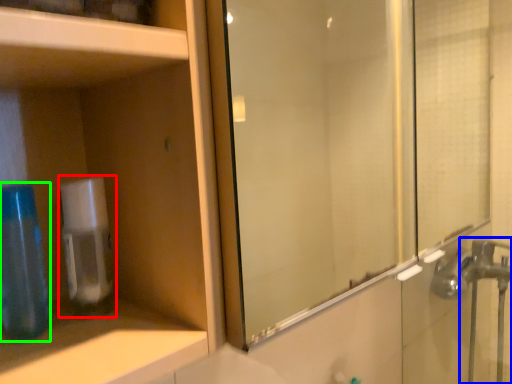
Question: Which is farther away from soap dispenser (highlighted by a red box)? faucet (highlighted by a blue box) or mouthwash (highlighted by a green box)?

Choices:
 (A) faucet
 (B) mouthwash

Answer: (A)